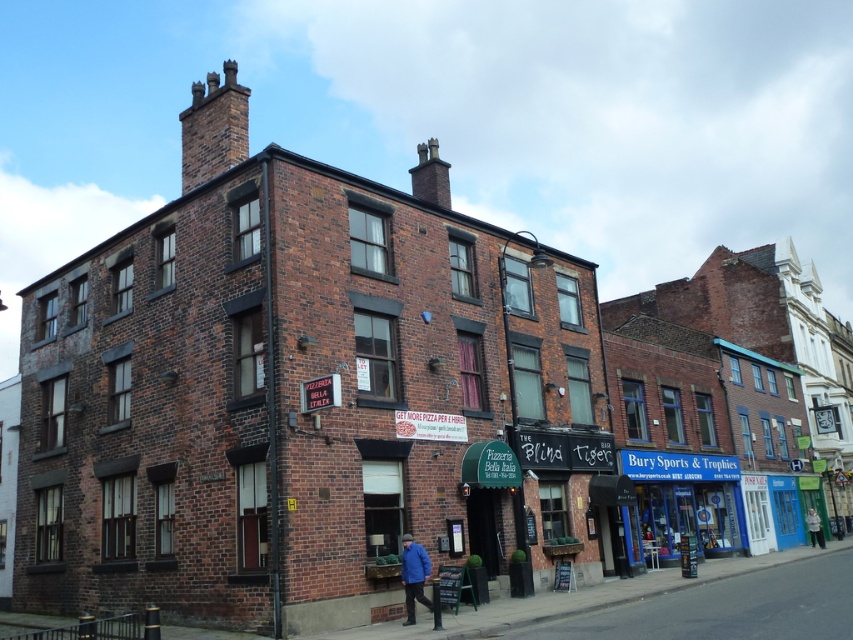
Which is behind, point (421, 573) or point (811, 544)?

Positioned behind is point (811, 544).

Is point (413, 614) farther from viewer compared to point (822, 545)?

No, (413, 614) is in front of (822, 545).

Identify the location of blue fabric jacket at lower center. 413,576.

Who is taller, blue glass storefront at center or light gray fabric jacket at lower right?

blue glass storefront at center is taller.

Locate an element on the screen. This screenshot has width=853, height=640. blue glass storefront at center is located at coordinates (683, 499).

Does point (708, 541) come behind point (412, 608)?

Yes.

Which is behind, point (677, 490) or point (405, 577)?

The point (677, 490) is behind.

The height and width of the screenshot is (640, 853). Identify the location of blue glass storefront at center. 683,499.